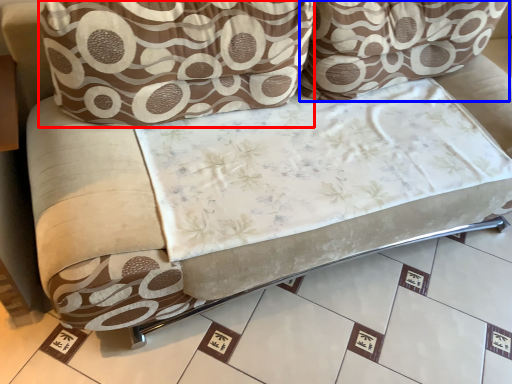
Question: Among these objects, which one is farthest to the camera, throw pillow (highlighted by a red box) or throw pillow (highlighted by a blue box)?

Choices:
 (A) throw pillow
 (B) throw pillow

Answer: (B)